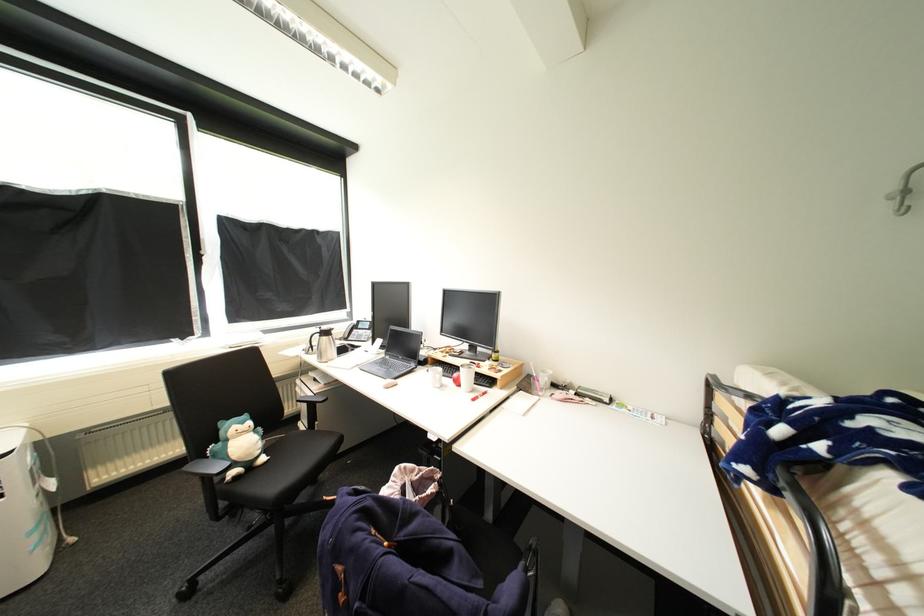
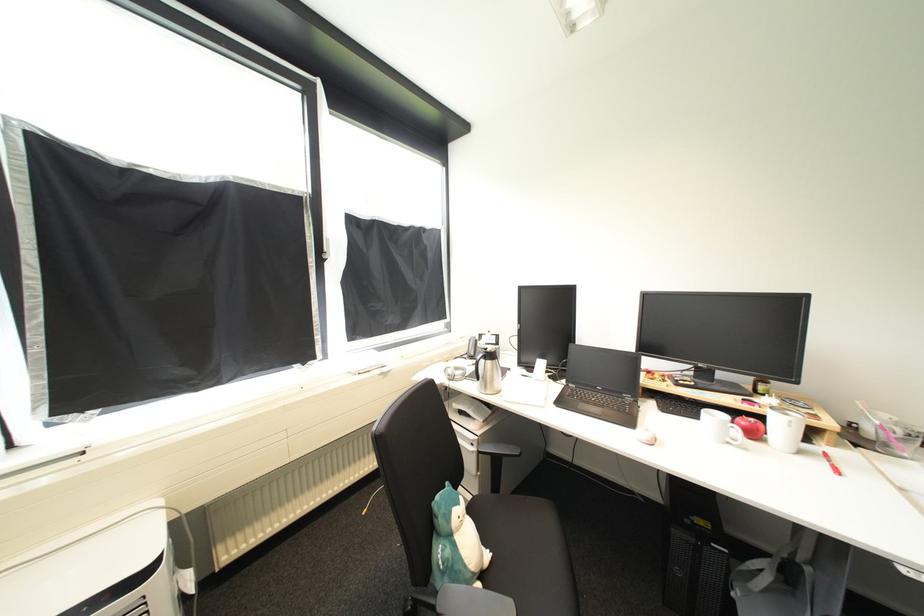
Where in the second image is the point corresponding to point 237,443 from the first image?

(464, 538)